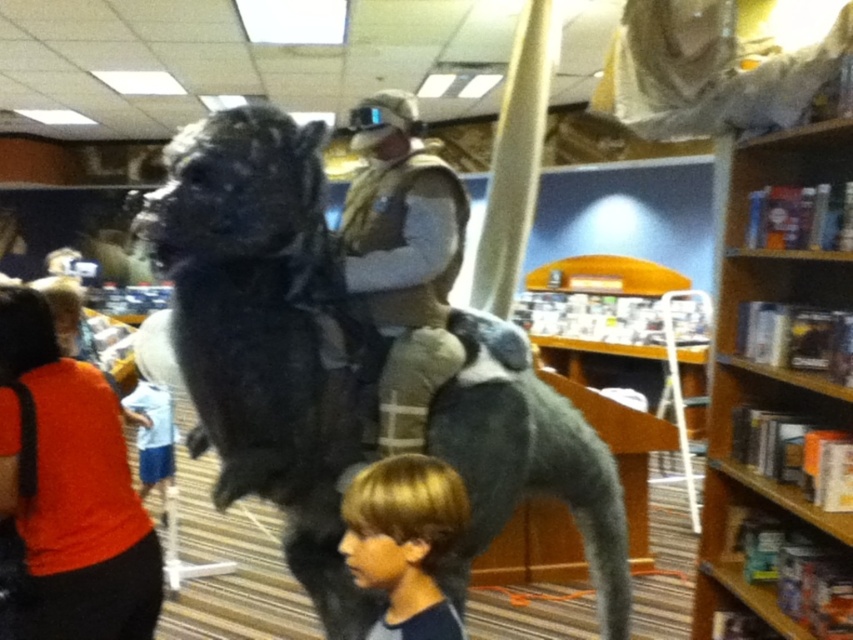
Question: Is furry black creature at center to the left of wooden bookshelf at right from the viewer's perspective?

Choices:
 (A) yes
 (B) no

Answer: (A)

Question: Which of the following is the farthest from the observer?

Choices:
 (A) (408, 209)
 (B) (196, 317)
 (C) (430, 618)
 (D) (822, 536)

Answer: (D)

Question: Which is nearer to the light blue shorts at lower left?

Choices:
 (A) orange fabric shirt at lower left
 (B) wooden bookshelf at right
 (C) furry black creature at center

Answer: (A)

Question: Which object is closer to the camera taking this photo?

Choices:
 (A) furry black creature at center
 (B) wooden bookshelf at right

Answer: (A)

Question: Is blonde hair at lower center positioned behind light blue shorts at lower left?

Choices:
 (A) no
 (B) yes

Answer: (A)

Question: Can you confirm if furry black creature at center is positioned below wooden bookshelf at right?

Choices:
 (A) no
 (B) yes

Answer: (B)